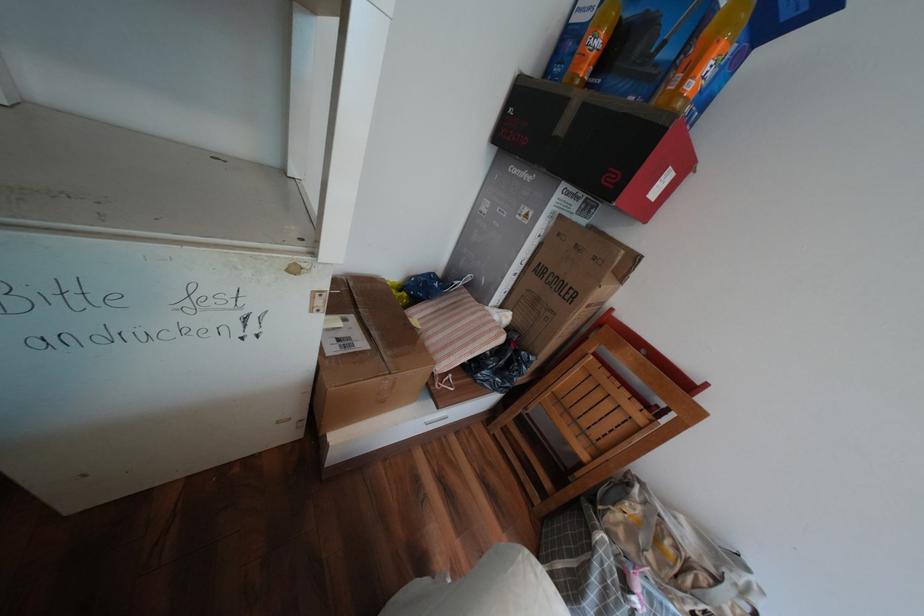
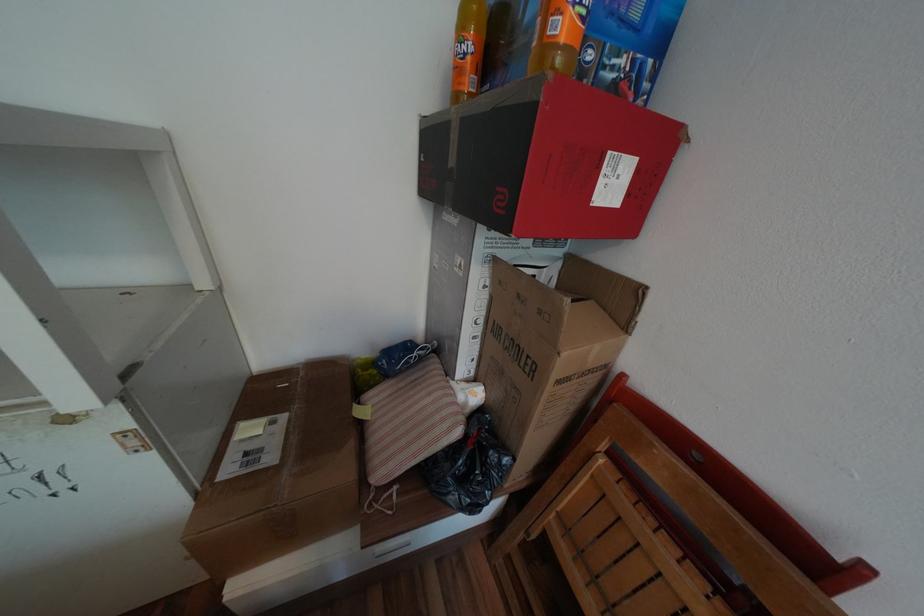
Where in the second image is the point corresponding to pixel 666 184 from the first image?

(611, 182)